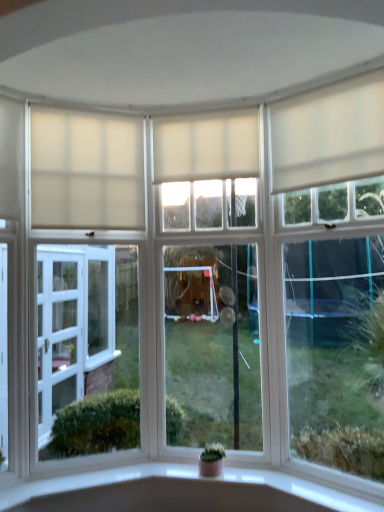
Locate an element on the screen. free point to the right of green matte houseplant at center is located at coordinates (243, 473).